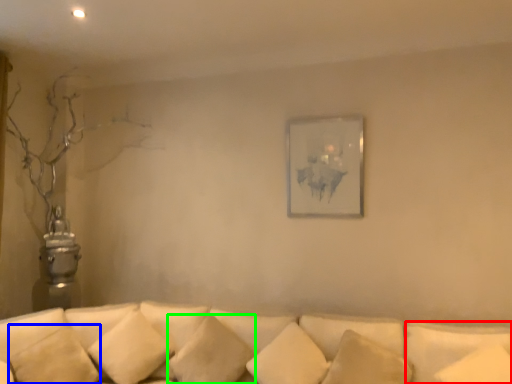
Question: Which object is the closest to the pillow (highlighted by a red box)? Choose among these: pillow (highlighted by a blue box) or pillow (highlighted by a green box).

Choices:
 (A) pillow
 (B) pillow

Answer: (B)